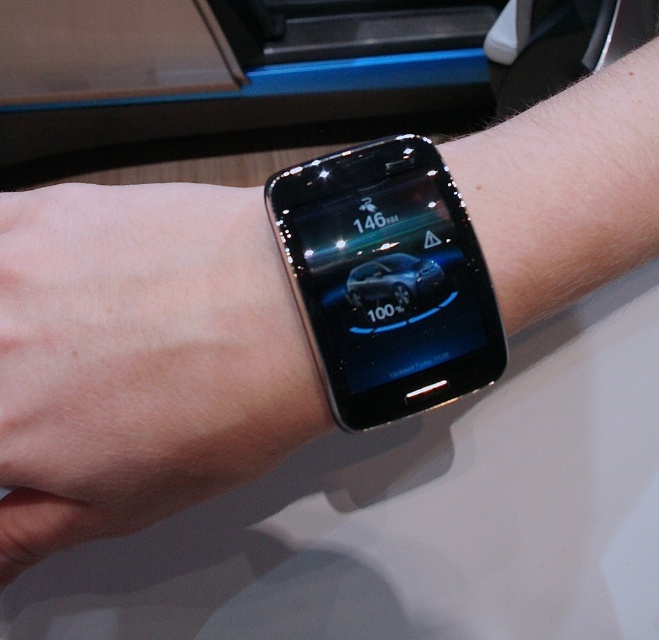
You are a driver checking your car dashboard. You see a satin gold watch at center and a sleek black smartwatch at center. Which one is positioned lower on your wrist?

The satin gold watch at center is positioned lower than the sleek black smartwatch at center on your wrist.

You are a driver checking your car dashboard. You see a satin gold watch at center and a sleek metallic car at center. Which object is positioned lower in your field of view?

The satin gold watch at center is positioned below the sleek metallic car at center, so it is lower in your field of view.

You are a driver who just received a notification on your car dashboard. You want to check your smartwatch to see if it matches the speed displayed. Given that your eyes are 1 meter away from the watch, can you comfortably read the speed displayed on the satin gold watch at center?

The satin gold watch at center is 24.97 centimeters away from the viewer. Since your eyes are 1 meter away from the watch, which is 100 centimeters, you are 75.03 centimeters away from the watch. This distance may make it difficult to comfortably read the speed displayed on the satin gold watch at center.